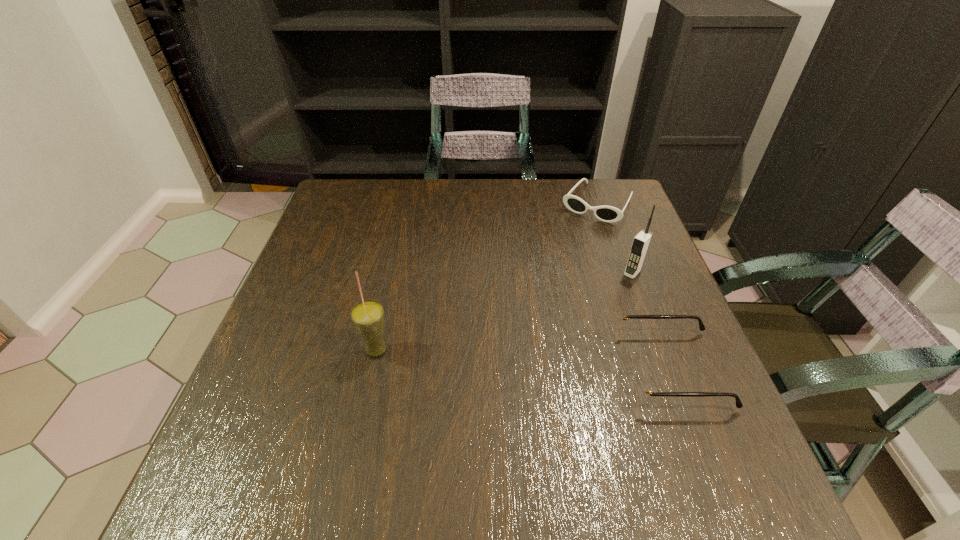
Identify the location of the leftmost object. (367, 316).

This screenshot has width=960, height=540. I want to click on spectacles, so click(x=640, y=385).

Image resolution: width=960 pixels, height=540 pixels. In order to click on cellular telephone in this screenshot , I will do `click(641, 242)`.

At what (x,y) coordinates should I click in order to perform the action: click on the farthest object. Please return your answer as a coordinate pair (x, y). Looking at the image, I should click on (609, 214).

Find the location of `free spot located on the back of the straw for drinking`. free spot located on the back of the straw for drinking is located at coordinates (394, 271).

What are the coordinates of `vacant space located at the hinge ends of the spectacles` in the screenshot? It's located at (522, 369).

Identify the location of vacant space located at the hinge ends of the spectacles. (563, 369).

The width and height of the screenshot is (960, 540). I want to click on free space located at the hinge ends of the spectacles, so click(533, 369).

You are a GUI agent. You are given a task and a screenshot of the screen. Output one action in this format:
    pyautogui.click(x=<x>, y=<y>)
    Task: Click on the vacant space located on the front-facing side of the cellular telephone
    Image resolution: width=960 pixels, height=540 pixels.
    Given the screenshot: What is the action you would take?
    pyautogui.click(x=539, y=375)

Where is `free space located on the front-facing side of the cellular telephone`? The height and width of the screenshot is (540, 960). free space located on the front-facing side of the cellular telephone is located at coordinates (536, 379).